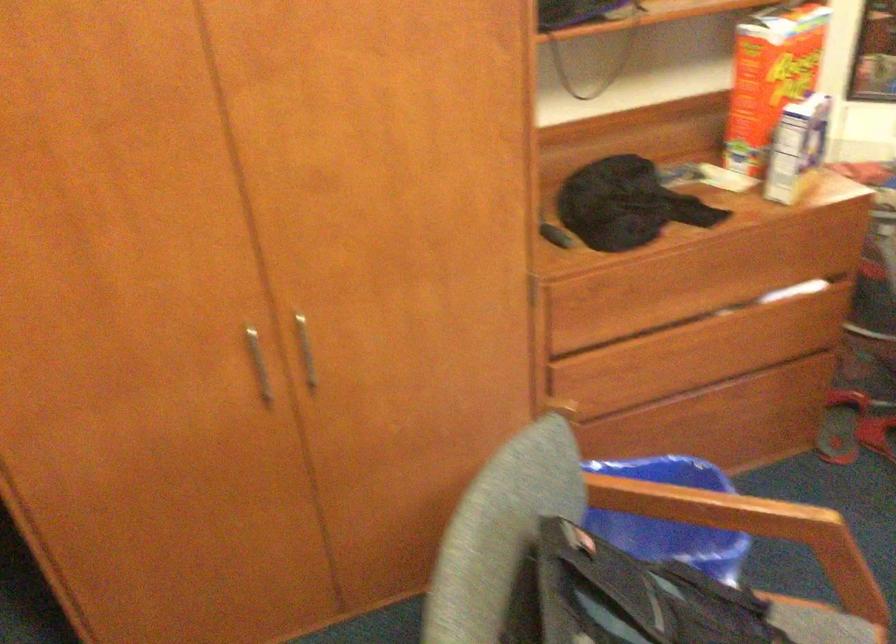
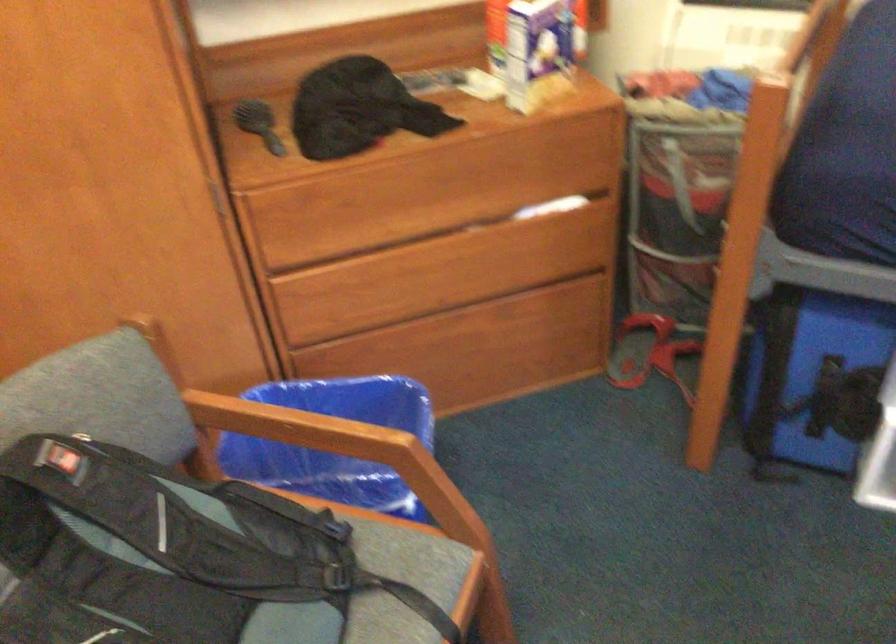
Find the pixel in the second image that matches point (797, 146) in the first image.

(531, 50)